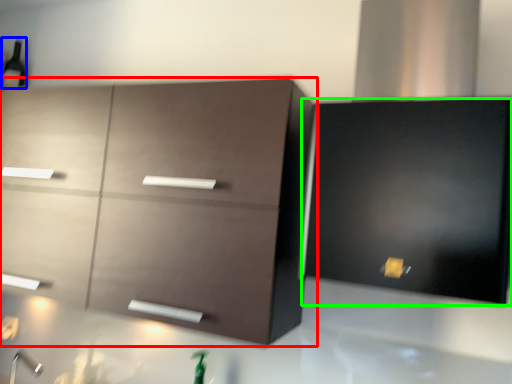
Question: Which object is the closest to the cabinetry (highlighted by a red box)? Choose among these: beer bottle (highlighted by a blue box) or cabinetry (highlighted by a green box).

Choices:
 (A) beer bottle
 (B) cabinetry

Answer: (B)